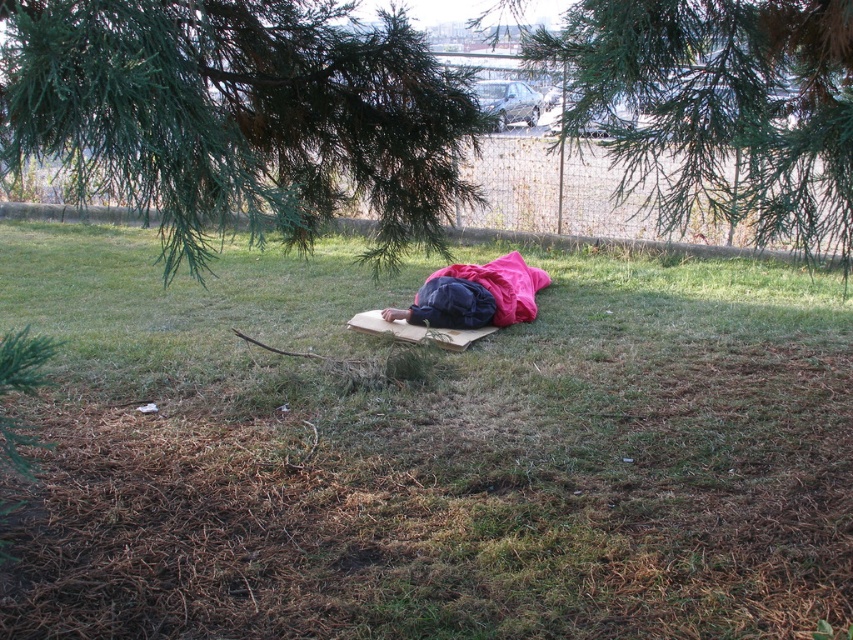
Question: Can you confirm if green leafy tree at center is positioned to the left of dark blue fabric sleeping bag at center?

Choices:
 (A) no
 (B) yes

Answer: (A)

Question: Which point is closer to the camera?

Choices:
 (A) (521, 476)
 (B) (451, 307)
 (C) (239, 60)

Answer: (A)

Question: Based on their relative distances, which object is farther from the green needle-like leaves at upper center?

Choices:
 (A) dark blue fabric sleeping bag at center
 (B) green grass at center
 (C) green leafy tree at center

Answer: (B)

Question: Does green needle-like leaves at upper center have a larger size compared to dark blue fabric sleeping bag at center?

Choices:
 (A) no
 (B) yes

Answer: (B)

Question: Considering the relative positions of green needle-like leaves at upper center and green leafy tree at center in the image provided, where is green needle-like leaves at upper center located with respect to green leafy tree at center?

Choices:
 (A) above
 (B) below

Answer: (A)

Question: Which of these objects is positioned closest to the green leafy tree at center?

Choices:
 (A) green grass at center
 (B) green needle-like leaves at upper center

Answer: (B)